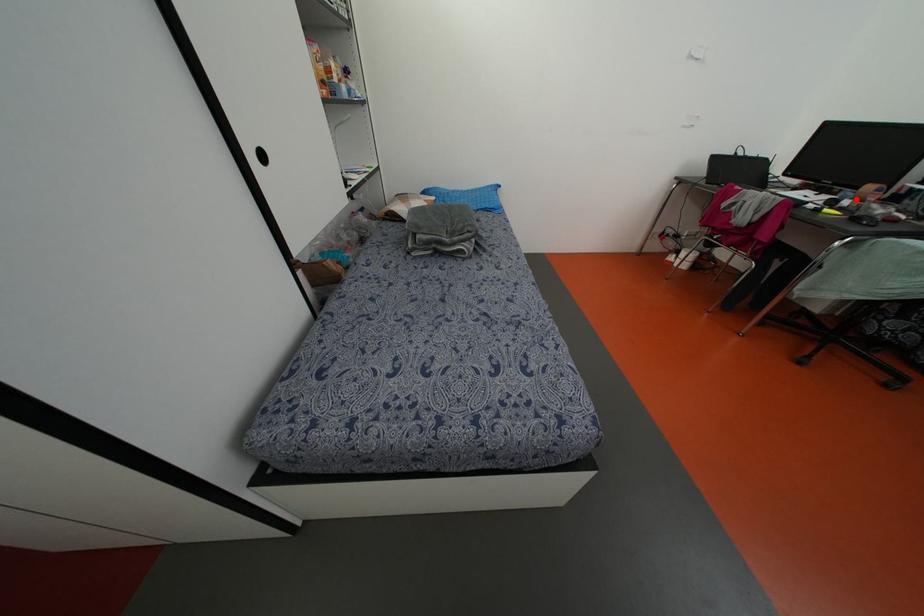
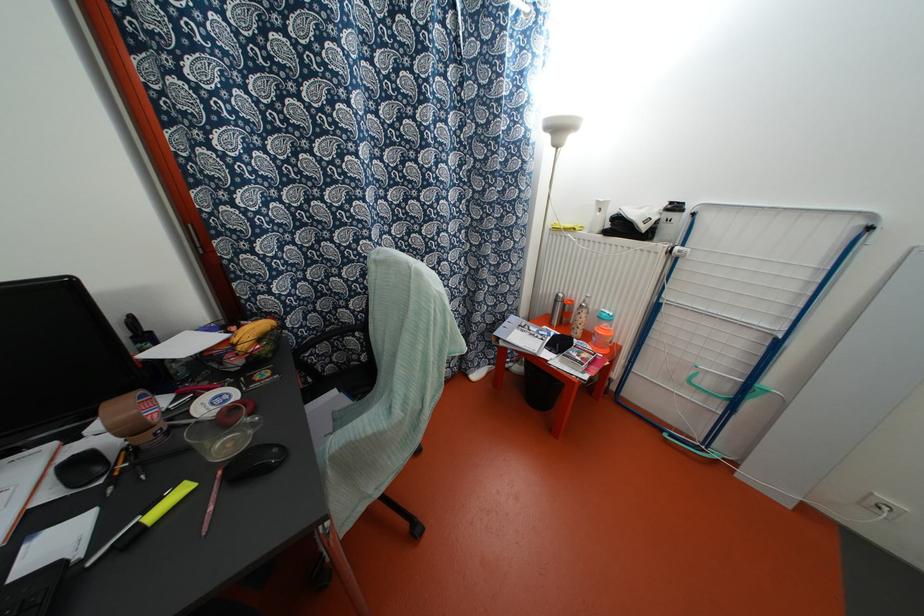
Question: A red point is marked in image1. In image2, is the corresponding 3D point closer to the camera or farther? Reply with the corresponding letter.

Choices:
 (A) The corresponding 3D point is closer.
 (B) The corresponding 3D point is farther.

Answer: (A)